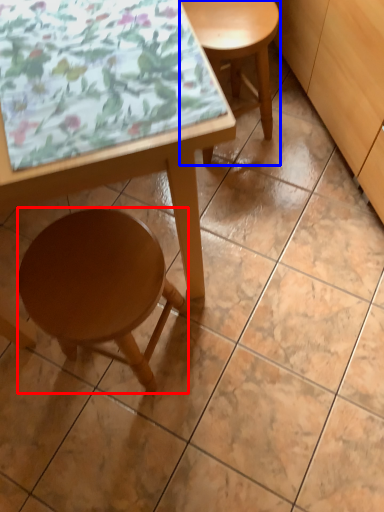
Question: Which point is closer to the camera, stool (highlighted by a red box) or stool (highlighted by a blue box)?

Choices:
 (A) stool
 (B) stool

Answer: (A)